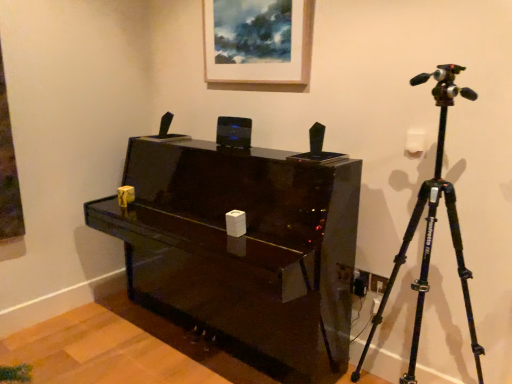
The width and height of the screenshot is (512, 384). What are the coordinates of `vacant space underneath glossy black piano at center (from a real-world perspective)` in the screenshot? It's located at (178, 350).